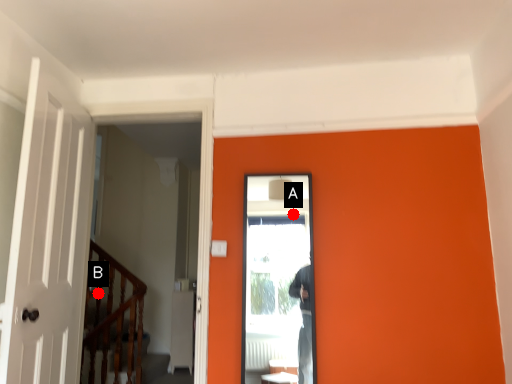
Question: Two points are circled on the image, labeled by A and B beside each circle. Among these points, which one is nearest to the camera?

Choices:
 (A) A is closer
 (B) B is closer

Answer: (A)